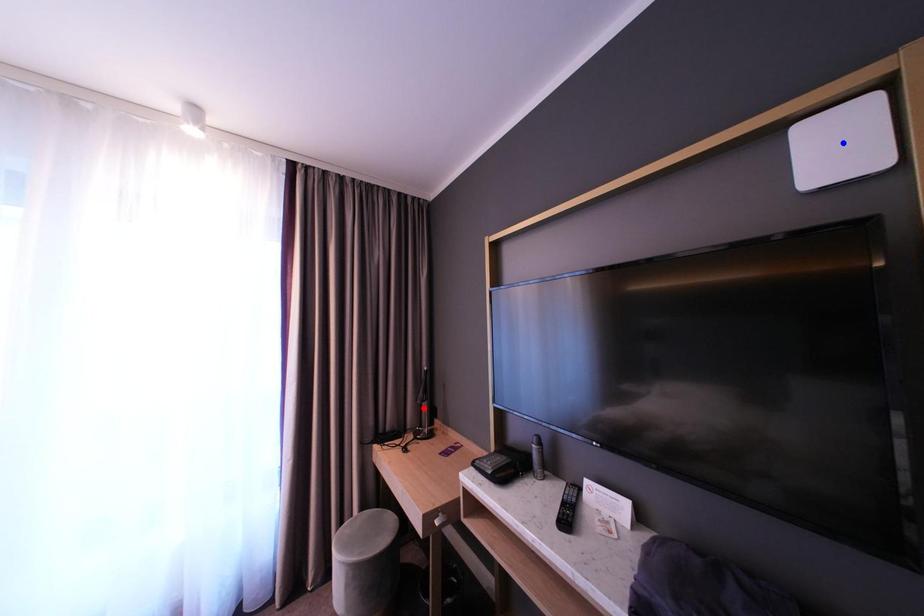
Question: Two points are marked on the image. Which point is closer to the camera?

Choices:
 (A) Blue point is closer.
 (B) Red point is closer.

Answer: (A)